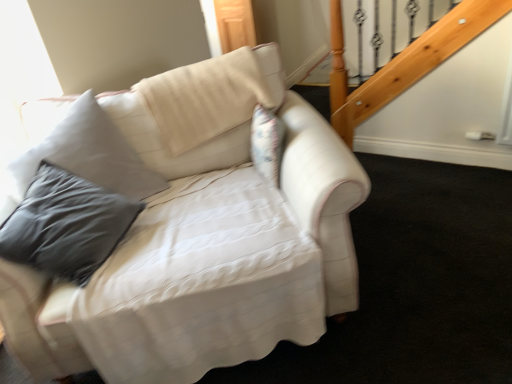
The width and height of the screenshot is (512, 384). Describe the element at coordinates (190, 246) in the screenshot. I see `white fabric couch at center` at that location.

Find the location of a particular element. This screenshot has height=384, width=512. white fabric couch at center is located at coordinates (190, 246).

Where is `beige fabric pillow at upper center`? beige fabric pillow at upper center is located at coordinates (207, 98).

Describe the element at coordinates (207, 98) in the screenshot. I see `beige fabric pillow at upper center` at that location.

Where is `white fabric couch at center`? Image resolution: width=512 pixels, height=384 pixels. white fabric couch at center is located at coordinates (190, 246).

Which object is positioned more to the right, beige fabric pillow at upper center or white fabric couch at center?

beige fabric pillow at upper center.

Which is behind, beige fabric pillow at upper center or white fabric couch at center?

beige fabric pillow at upper center.

Considering the positions of points (218, 82) and (308, 337), is point (218, 82) closer to camera compared to point (308, 337)?

That is False.

From the image's perspective, is beige fabric pillow at upper center above or below white fabric couch at center?

beige fabric pillow at upper center is situated higher than white fabric couch at center in the image.

From a real-world perspective, is beige fabric pillow at upper center located higher than white fabric couch at center?

Correct, in the physical world, beige fabric pillow at upper center is higher than white fabric couch at center.

Between beige fabric pillow at upper center and white fabric couch at center, which one has larger width?

white fabric couch at center.

Considering the relative sizes of beige fabric pillow at upper center and white fabric couch at center in the image provided, is beige fabric pillow at upper center taller than white fabric couch at center?

In fact, beige fabric pillow at upper center may be shorter than white fabric couch at center.

Is beige fabric pillow at upper center smaller than white fabric couch at center?

Yes, beige fabric pillow at upper center is smaller than white fabric couch at center.

Looking at this image, does beige fabric pillow at upper center contain white fabric couch at center?

No, white fabric couch at center is located outside of beige fabric pillow at upper center.

Looking at this image, can you see beige fabric pillow at upper center touching white fabric couch at center?

They are not placed beside each other.

Is white fabric couch at center at the back of beige fabric pillow at upper center?

Yes, beige fabric pillow at upper center is facing away from white fabric couch at center.

Can you tell me how much beige fabric pillow at upper center and white fabric couch at center differ in facing direction?

The facing directions of beige fabric pillow at upper center and white fabric couch at center are 3.85 degrees apart.

At what (x,y) coordinates should I click in order to perform the action: click on pillow that is on the right side of white fabric couch at center. Please return your answer as a coordinate pair (x, y). Looking at the image, I should click on point(207,98).

Between white fabric couch at center and beige fabric pillow at upper center, which one appears on the right side from the viewer's perspective?

beige fabric pillow at upper center.

Does white fabric couch at center lie behind beige fabric pillow at upper center?

No, white fabric couch at center is in front of beige fabric pillow at upper center.

Which is farther, (193, 273) or (155, 98)?

The point (155, 98) is more distant.

From the picture: From the image's perspective, is white fabric couch at center above beige fabric pillow at upper center?

No, from the image's perspective, white fabric couch at center is not above beige fabric pillow at upper center.

From a real-world perspective, relative to beige fabric pillow at upper center, is white fabric couch at center vertically above or below?

Clearly, from a real-world perspective, white fabric couch at center is below beige fabric pillow at upper center.

From the picture: Does white fabric couch at center have a lesser width compared to beige fabric pillow at upper center?

Incorrect, the width of white fabric couch at center is not less than that of beige fabric pillow at upper center.

In terms of height, does white fabric couch at center look taller or shorter compared to beige fabric pillow at upper center?

white fabric couch at center is taller than beige fabric pillow at upper center.

Is white fabric couch at center smaller than beige fabric pillow at upper center?

No, white fabric couch at center is not smaller than beige fabric pillow at upper center.

Is white fabric couch at center outside of beige fabric pillow at upper center?

Absolutely, white fabric couch at center is external to beige fabric pillow at upper center.

Does white fabric couch at center touch beige fabric pillow at upper center?

No, white fabric couch at center is not touching beige fabric pillow at upper center.

Is white fabric couch at center aimed at beige fabric pillow at upper center?

No, white fabric couch at center does not turn towards beige fabric pillow at upper center.

Can you tell me how much white fabric couch at center and beige fabric pillow at upper center differ in facing direction?

3.85 degrees.

Locate an element on the screen. The image size is (512, 384). pillow that appears on the right of white fabric couch at center is located at coordinates (207, 98).

The image size is (512, 384). Find the location of `studio couch below the beige fabric pillow at upper center (from the image's perspective)`. studio couch below the beige fabric pillow at upper center (from the image's perspective) is located at coordinates (190, 246).

Where is `studio couch on the left of beige fabric pillow at upper center`? studio couch on the left of beige fabric pillow at upper center is located at coordinates (190, 246).